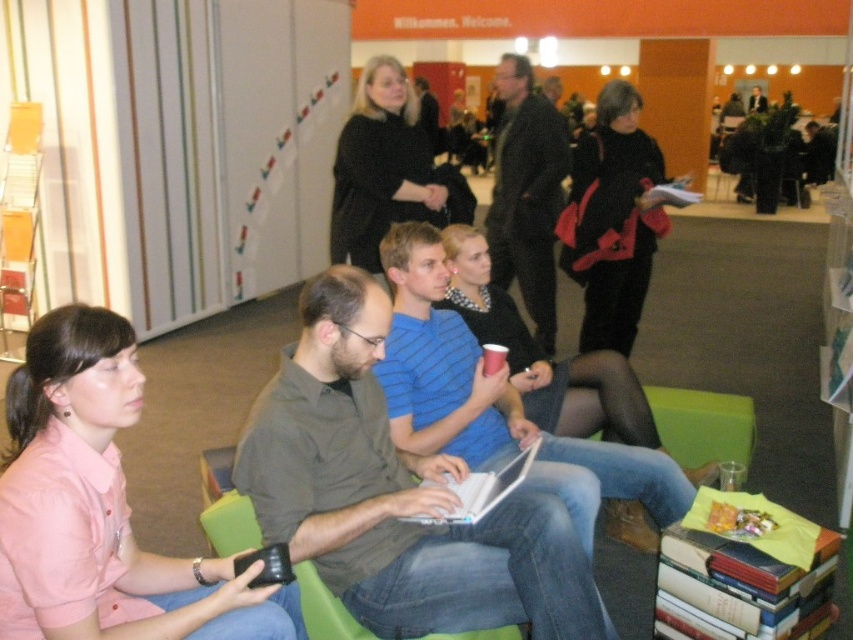
You are attending a meeting in the conference room and need to retrieve your laptop. You see the black matte jacket at upper center and the white plastic laptop at center. Which object is positioned higher in the image?

The black matte jacket at upper center is located above the white plastic laptop at center, so it is positioned higher in the image.

You are organizing a photo shoot and need to arrange the black matte jacket at upper center and the blue striped shirt at center based on their sizes. Which one should be placed on a higher shelf to match their proportions?

The black matte jacket at upper center should be placed on a higher shelf since it has a greater height compared to the blue striped shirt at center.

You are standing in the conference room and want to move from point A to point B. Point A is at coordinate point(624, 353) and point B is at coordinate point(355, 115). Which point is closer to you?

Point(624, 353) is closer to you because it is further to the viewer than point(355, 115).